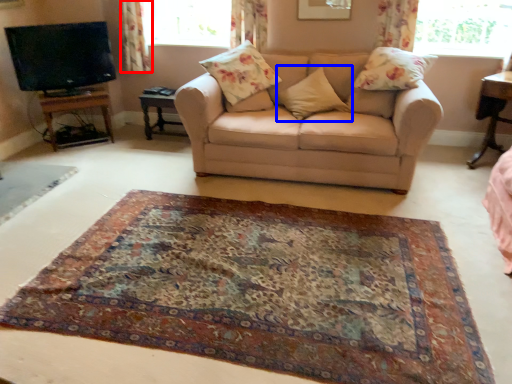
Question: Which object is closer to the camera taking this photo, curtain (highlighted by a red box) or pillow (highlighted by a blue box)?

Choices:
 (A) curtain
 (B) pillow

Answer: (B)